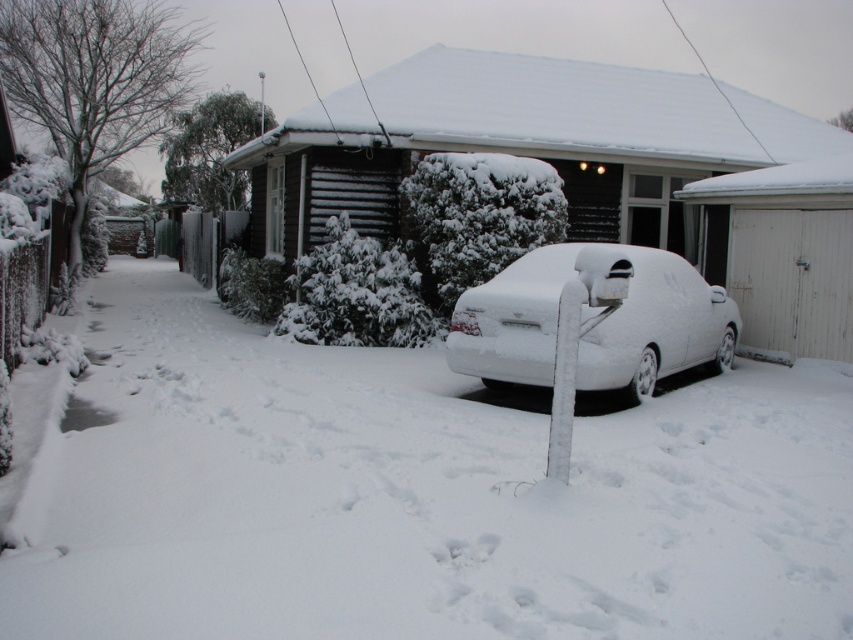
You are standing in front of the snowy house and want to determine the position of two points marked in the image. Which point, point 1 at coordinates (456, 305) or point 2 at coordinates (572, 388), is closer to you?

Point 1 at coordinates (456, 305) is closer to you because it is further to the camera than point 2 at coordinates (572, 388).

From the picture: You are a delivery person trying to park your van next to the white matte car at center and the white frosted post at center. Which object should you avoid to prevent collision with your van?

You should avoid the white frosted post at center because the white matte car at center is wider, so the post is narrower and more likely to be hit by the van.

Based on the photo, you are standing in the snowy scene and see the white fluffy snow at center and the white frosted post at center. Which object is nearer to you?

The white fluffy snow at center is closer to the viewer than the white frosted post at center.